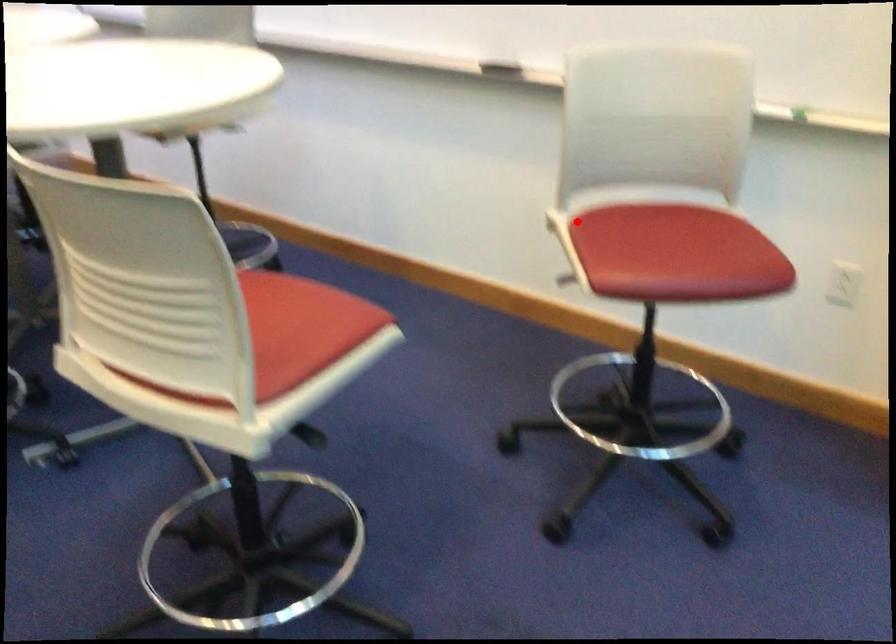
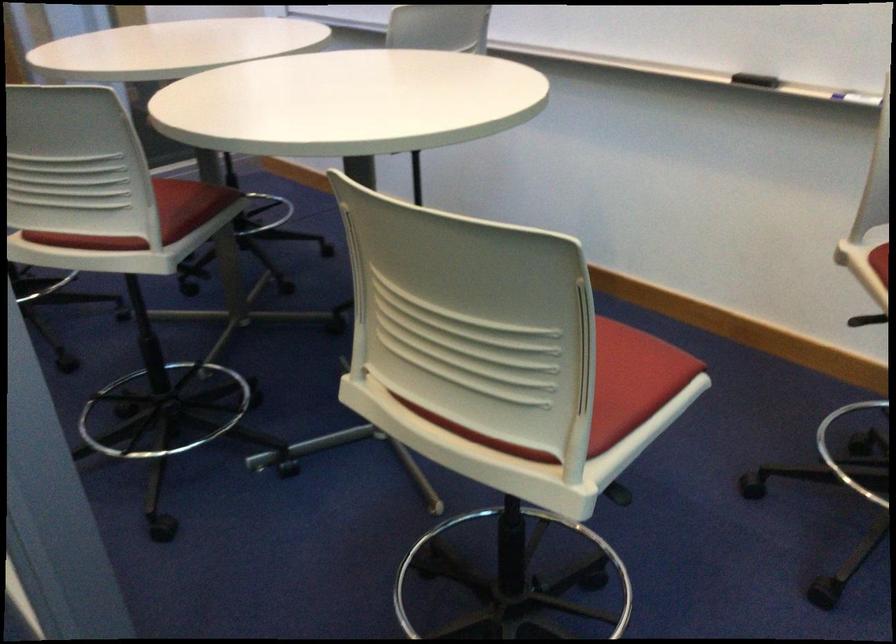
Question: I am providing you with two images of the same scene from different viewpoints. In image1, a red point is highlighted. Considering the same 3D point in image2, which of the following is correct?

Choices:
 (A) It is closer
 (B) It is farther

Answer: (A)